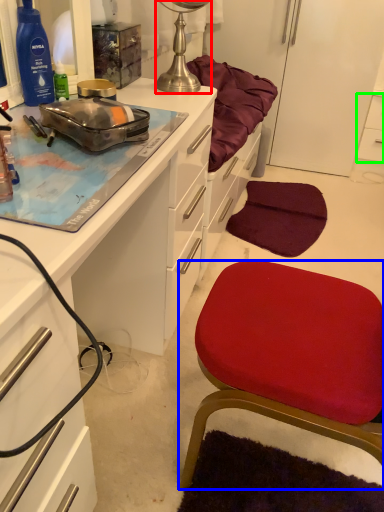
Question: Which object is the closest to the lamp (highlighted by a red box)? Choose among these: chair (highlighted by a blue box) or cabinetry (highlighted by a green box).

Choices:
 (A) chair
 (B) cabinetry

Answer: (B)